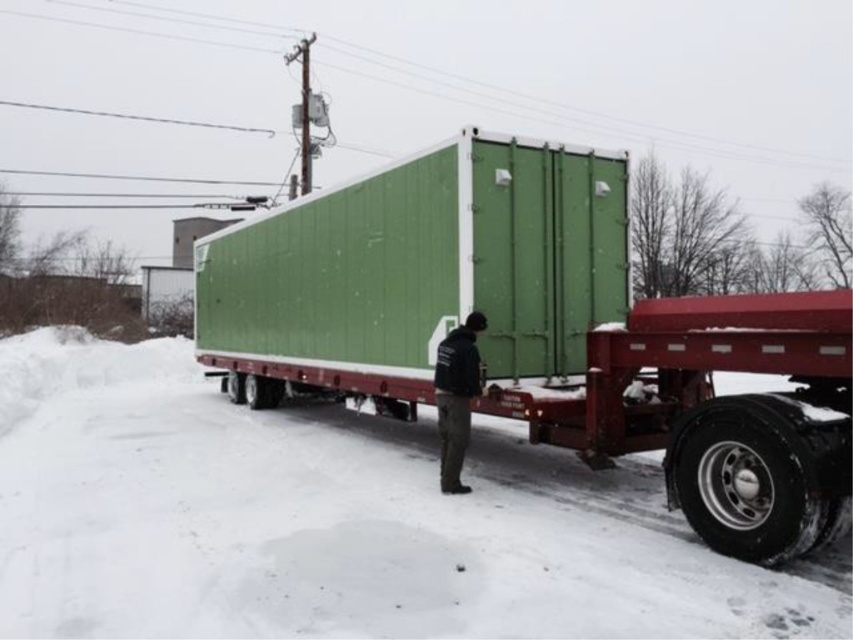
Is green matte container at center to the right of dark green jacket at center from the viewer's perspective?

In fact, green matte container at center is to the left of dark green jacket at center.

Does point (587, 417) come behind point (465, 355)?

No, it is not.

The width and height of the screenshot is (853, 640). What are the coordinates of `green matte container at center` in the screenshot? It's located at (538, 330).

Does white powdery snow at lower center lie in front of dark green jacket at center?

That is True.

Is white powdery snow at lower center taller than dark green jacket at center?

No.

Describe the element at coordinates (335, 522) in the screenshot. I see `white powdery snow at lower center` at that location.

Locate an element on the screen. The width and height of the screenshot is (853, 640). white powdery snow at lower center is located at coordinates (335, 522).

Which is below, white powdery snow at lower center or green matte container at center?

white powdery snow at lower center is lower down.

Describe the element at coordinates (335, 522) in the screenshot. I see `white powdery snow at lower center` at that location.

Who is more distant from viewer, (68, 440) or (328, 269)?

The point (68, 440) is more distant.

At what (x,y) coordinates should I click in order to perform the action: click on white powdery snow at lower center. Please return your answer as a coordinate pair (x, y). Image resolution: width=853 pixels, height=640 pixels. Looking at the image, I should click on (335, 522).